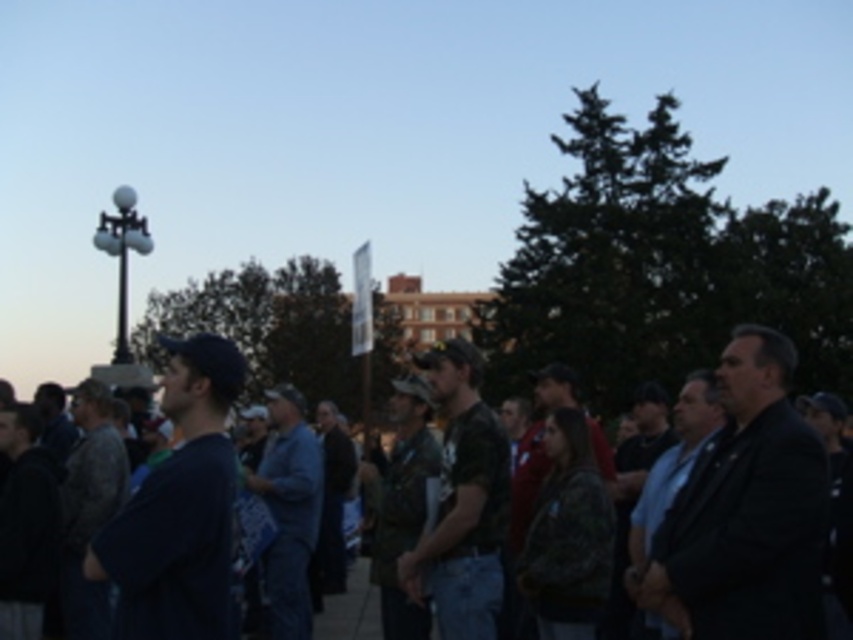
You are standing at the origin point in the image. Which direction should you move to reach the dark gray suit at right?

The dark gray suit at right is located at point 0.800 on the x axis and 0.875 on the y axis, so you should move to the right and slightly upwards to reach it.

You are part of the crowd in the image and want to hand a document to the person wearing the denim jacket at center. The document needs to be passed through the dark blue shirt at left. Is this possible?

The dark blue shirt at left is in front of the denim jacket at center, so you would need to go around the dark blue shirt at left to reach the denim jacket at center directly. Passing the document through the dark blue shirt at left might not be possible unless they are willing to relay it.